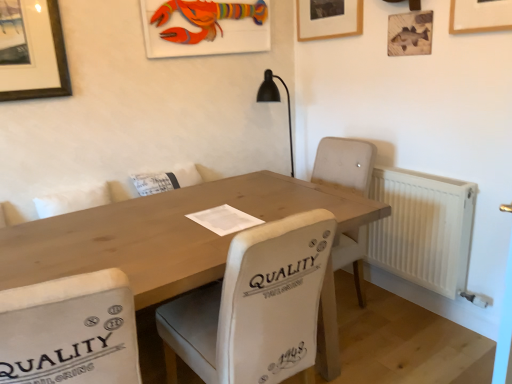
You are a GUI agent. You are given a task and a screenshot of the screen. Output one action in this format:
    pyautogui.click(x=<x>, y=<y>)
    Task: Click on the white plastic radiator at right
    This screenshot has height=384, width=512.
    Given the screenshot: What is the action you would take?
    pyautogui.click(x=423, y=228)

This screenshot has width=512, height=384. I want to click on wooden picture frame at upper center, which is counted as the second picture frame, starting from the left, so coord(329,19).

From the image's perspective, who appears lower, white fabric chair at lower left, the 2th chair positioned from the right, or white plastic radiator at right?

white fabric chair at lower left, the 2th chair positioned from the right.

From a real-world perspective, is white fabric chair at lower left, which is the first chair from left to right, physically above white plastic radiator at right?

Yes, from a real-world perspective, white fabric chair at lower left, which is the first chair from left to right, is over white plastic radiator at right

Can you confirm if white fabric chair at lower left, which is the first chair from left to right, is smaller than white plastic radiator at right?

No.

Between wooden picture frame at upper center, which ranks as the second picture frame in right-to-left order, and natural wood table at center, which one is positioned in front?

Positioned in front is natural wood table at center.

Which of these two, wooden picture frame at upper center, which ranks as the second picture frame in right-to-left order, or natural wood table at center, is smaller?

wooden picture frame at upper center, which ranks as the second picture frame in right-to-left order, is smaller.

Which is correct: wooden picture frame at upper center, which is counted as the second picture frame, starting from the left, is inside natural wood table at center, or outside of it?

wooden picture frame at upper center, which is counted as the second picture frame, starting from the left, is outside natural wood table at center.

What's the angular difference between wooden picture frame at upper center, which is counted as the second picture frame, starting from the left, and natural wood table at center's facing directions?

89.1 degrees.

Is white fabric chair at lower left, the 2th chair positioned from the right, at the right side of wooden picture frame at upper center, which is counted as the second picture frame, starting from the left?

No.

Is white fabric chair at lower left, which is the first chair from left to right, turned away from wooden picture frame at upper center, which ranks as the second picture frame in right-to-left order?

No.

From a real-world perspective, is white fabric chair at lower left, the 2th chair positioned from the right, positioned over wooden picture frame at upper center, which ranks as the second picture frame in right-to-left order, based on gravity?

No, from a real-world perspective, white fabric chair at lower left, the 2th chair positioned from the right, is not over wooden picture frame at upper center, which ranks as the second picture frame in right-to-left order

From the image's perspective, is white plastic radiator at right over wooden picture frame at upper center, which ranks as the second picture frame in right-to-left order?

No, from the image's perspective, white plastic radiator at right is not above wooden picture frame at upper center, which ranks as the second picture frame in right-to-left order.

Considering the positions of point (411, 268) and point (331, 34), is point (411, 268) closer or farther from the camera than point (331, 34)?

Clearly, point (411, 268) is closer to the camera than point (331, 34).

Considering the positions of objects white plastic radiator at right and wooden picture frame at upper center, which is counted as the second picture frame, starting from the left, in the image provided, who is behind, white plastic radiator at right or wooden picture frame at upper center, which is counted as the second picture frame, starting from the left,?

wooden picture frame at upper center, which is counted as the second picture frame, starting from the left, is more distant.

Can you tell me how much white plastic radiator at right and wooden picture frame at upper center, which ranks as the second picture frame in right-to-left order, differ in facing direction?

There is a 0.214-degree angle between the facing directions of white plastic radiator at right and wooden picture frame at upper center, which ranks as the second picture frame in right-to-left order.

Is white fabric chair at center, which is the second chair in left-to-right order, facing away from wooden fish at upper right, the 1th picture frame positioned from the right?

That's not correct — white fabric chair at center, which is the second chair in left-to-right order, is not looking away from wooden fish at upper right, the 1th picture frame positioned from the right.

In the scene shown: Can you tell me how much white fabric chair at center, which is the second chair in left-to-right order, and wooden fish at upper right, the 1th picture frame positioned from the right, differ in facing direction?

There is a 95.2-degree angle between the facing directions of white fabric chair at center, which is the second chair in left-to-right order, and wooden fish at upper right, the 1th picture frame positioned from the right.

Would you consider white fabric chair at center, which is the second chair in left-to-right order, to be distant from wooden fish at upper right, which is the 3th picture frame in left-to-right order?

white fabric chair at center, which is the second chair in left-to-right order, is positioned a significant distance from wooden fish at upper right, which is the 3th picture frame in left-to-right order.

Is white fabric chair at center, which is the second chair in left-to-right order, at the right side of wooden fish at upper right, which is the 3th picture frame in left-to-right order?

Incorrect, white fabric chair at center, which is the second chair in left-to-right order, is not on the right side of wooden fish at upper right, which is the 3th picture frame in left-to-right order.

What's the angular difference between wooden picture frame at upper center, which ranks as the second picture frame in right-to-left order, and wooden lobster at upper center, positioned as the 1th picture frame in left-to-right order,'s facing directions?

87.6 degrees.

Choose the correct answer: Is wooden picture frame at upper center, which is counted as the second picture frame, starting from the left, inside wooden lobster at upper center, which ranks as the 3th picture frame in right-to-left order, or outside it?

wooden picture frame at upper center, which is counted as the second picture frame, starting from the left, is spatially situated outside wooden lobster at upper center, which ranks as the 3th picture frame in right-to-left order.

Is wooden picture frame at upper center, which is counted as the second picture frame, starting from the left, wider or thinner than wooden lobster at upper center, positioned as the 1th picture frame in left-to-right order?

wooden picture frame at upper center, which is counted as the second picture frame, starting from the left, is thinner than wooden lobster at upper center, positioned as the 1th picture frame in left-to-right order.

Is wooden picture frame at upper center, which ranks as the second picture frame in right-to-left order, smaller than wooden lobster at upper center, which ranks as the 3th picture frame in right-to-left order?

Yes, wooden picture frame at upper center, which ranks as the second picture frame in right-to-left order, is smaller than wooden lobster at upper center, which ranks as the 3th picture frame in right-to-left order.

Is white fabric chair at lower left, the 2th chair positioned from the right, completely or partially outside of wooden lobster at upper center, which ranks as the 3th picture frame in right-to-left order?

Yes, white fabric chair at lower left, the 2th chair positioned from the right, is not within wooden lobster at upper center, which ranks as the 3th picture frame in right-to-left order.

Is there a large distance between white fabric chair at lower left, the 2th chair positioned from the right, and wooden lobster at upper center, which ranks as the 3th picture frame in right-to-left order?

Absolutely, white fabric chair at lower left, the 2th chair positioned from the right, is distant from wooden lobster at upper center, which ranks as the 3th picture frame in right-to-left order.

Can you confirm if white fabric chair at lower left, which is the first chair from left to right, is bigger than wooden lobster at upper center, which ranks as the 3th picture frame in right-to-left order?

Indeed, white fabric chair at lower left, which is the first chair from left to right, has a larger size compared to wooden lobster at upper center, which ranks as the 3th picture frame in right-to-left order.

In the scene shown: Is white fabric chair at lower left, the 2th chair positioned from the right, behind wooden lobster at upper center, which ranks as the 3th picture frame in right-to-left order?

No, it is not.

I want to click on radiator behind the white fabric chair at lower left, which is the first chair from left to right, so click(423, 228).

Find the location of a particular element. Image resolution: width=512 pixels, height=384 pixels. picture frame that is the 3rd one above the natural wood table at center (from a real-world perspective) is located at coordinates (329, 19).

Consider the image. From the image, which object appears to be nearer to natural wood table at center, white fabric chair at center, which is the first chair in right-to-left order, or wooden fish at upper right, the 1th picture frame positioned from the right?

white fabric chair at center, which is the first chair in right-to-left order, lies closer to natural wood table at center than the other object.

In the scene shown: When comparing their distances from natural wood table at center, does white fabric chair at lower left, which is the first chair from left to right, or wooden picture frame at upper center, which is counted as the second picture frame, starting from the left, seem further?

wooden picture frame at upper center, which is counted as the second picture frame, starting from the left.

Estimate the real-world distances between objects in this image. Which object is further from white fabric chair at center, which is the first chair in right-to-left order, natural wood table at center or wooden fish at upper right, the 1th picture frame positioned from the right?

wooden fish at upper right, the 1th picture frame positioned from the right, lies further to white fabric chair at center, which is the first chair in right-to-left order, than the other object.

When comparing their distances from wooden picture frame at upper center, which is counted as the second picture frame, starting from the left, does natural wood table at center or wooden fish at upper right, the 1th picture frame positioned from the right, seem closer?

wooden fish at upper right, the 1th picture frame positioned from the right, is closer to wooden picture frame at upper center, which is counted as the second picture frame, starting from the left.

When comparing their distances from wooden picture frame at upper center, which is counted as the second picture frame, starting from the left, does wooden fish at upper right, which is the 3th picture frame in left-to-right order, or wooden lobster at upper center, positioned as the 1th picture frame in left-to-right order, seem closer?

The object closer to wooden picture frame at upper center, which is counted as the second picture frame, starting from the left, is wooden fish at upper right, which is the 3th picture frame in left-to-right order.

Estimate the real-world distances between objects in this image. Which object is further from white fabric chair at lower left, the 2th chair positioned from the right, wooden fish at upper right, the 1th picture frame positioned from the right, or white plastic radiator at right?

wooden fish at upper right, the 1th picture frame positioned from the right, is further to white fabric chair at lower left, the 2th chair positioned from the right.

Looking at the image, which one is located closer to wooden lobster at upper center, which ranks as the 3th picture frame in right-to-left order, white fabric chair at lower left, the 2th chair positioned from the right, or white plastic radiator at right?

Based on the image, white plastic radiator at right appears to be nearer to wooden lobster at upper center, which ranks as the 3th picture frame in right-to-left order.

Which object lies further to the anchor point wooden fish at upper right, which is the 3th picture frame in left-to-right order, natural wood table at center or wooden lobster at upper center, positioned as the 1th picture frame in left-to-right order?

The object further to wooden fish at upper right, which is the 3th picture frame in left-to-right order, is natural wood table at center.

At what (x,y) coordinates should I click in order to perform the action: click on chair situated between natural wood table at center and white plastic radiator at right from left to right. Please return your answer as a coordinate pair (x, y). The width and height of the screenshot is (512, 384). Looking at the image, I should click on (256, 305).

At what (x,y) coordinates should I click in order to perform the action: click on table between wooden picture frame at upper center, which ranks as the second picture frame in right-to-left order, and white fabric chair at lower left, which is the first chair from left to right, vertically. Please return your answer as a coordinate pair (x, y). Looking at the image, I should click on (165, 233).

At what (x,y) coordinates should I click in order to perform the action: click on picture frame between wooden lobster at upper center, positioned as the 1th picture frame in left-to-right order, and wooden fish at upper right, which is the 3th picture frame in left-to-right order. Please return your answer as a coordinate pair (x, y). Looking at the image, I should click on pyautogui.click(x=329, y=19).

Identify the location of chair that lies between wooden lobster at upper center, positioned as the 1th picture frame in left-to-right order, and natural wood table at center from top to bottom. This screenshot has width=512, height=384. (256, 305).